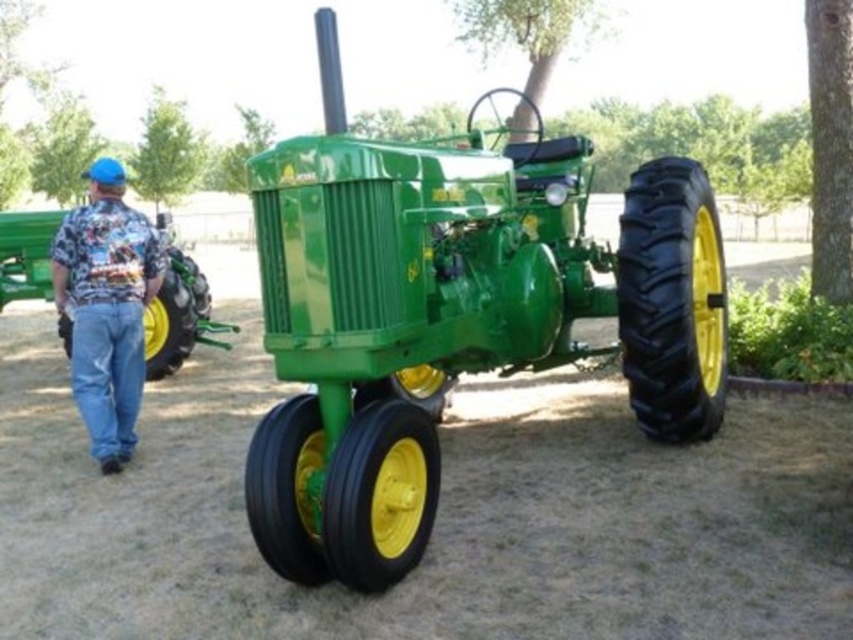
You are standing in a field and see the floral shirt at left and the green matte tractor at left. Which object is closer to your right side?

The floral shirt at left is closer to your right side because it is positioned to the right of the green matte tractor at left.

You are a farmer standing in a field and see the green polished metal tractor at center and the green matte tractor at left. Which tractor is closer to the right edge of the field?

The green polished metal tractor at center is closer to the right edge of the field because it is positioned on the right side of the green matte tractor at left.

Based on the scene description, which object is located at the coordinates point (450, 316)?

The point (450, 316) indicates the green polished metal tractor at center.